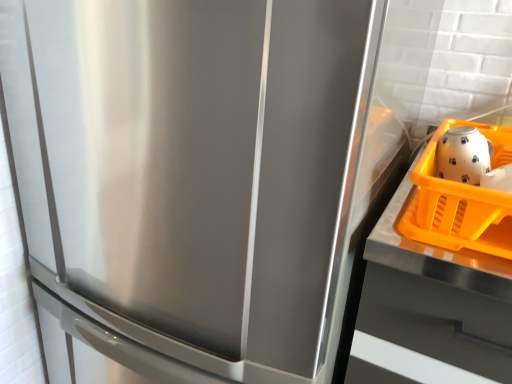
Question: Would you say orange plastic tray at right is inside or outside white glossy tea pot at upper right?

Choices:
 (A) outside
 (B) inside

Answer: (A)

Question: From a real-world perspective, relative to white glossy tea pot at upper right, is orange plastic tray at right vertically above or below?

Choices:
 (A) below
 (B) above

Answer: (A)

Question: Estimate the real-world distances between objects in this image. Which object is closer to the white glossy tea pot at upper right?

Choices:
 (A) orange plastic tray at right
 (B) orange plastic basket at right

Answer: (B)

Question: Which object is the farthest from the orange plastic tray at right?

Choices:
 (A) orange plastic basket at right
 (B) white glossy tea pot at upper right

Answer: (B)